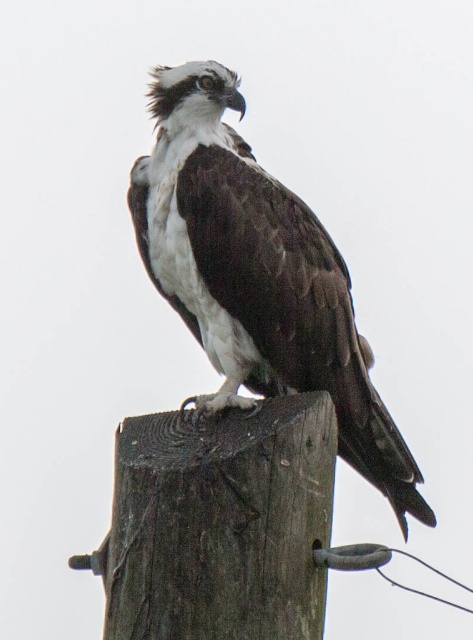
Between brown/white feathered bird at center and brown wood post at upper center, which one has less height?

With less height is brown wood post at upper center.

Is brown/white feathered bird at center thinner than brown wood post at upper center?

No, brown/white feathered bird at center is not thinner than brown wood post at upper center.

Does point (148, 92) come in front of point (297, 474)?

No.

Where is `brown/white feathered bird at center`? The width and height of the screenshot is (473, 640). brown/white feathered bird at center is located at coordinates (257, 275).